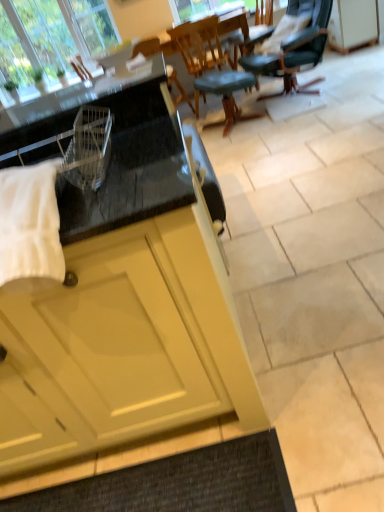
Image resolution: width=384 pixels, height=512 pixels. Identify the location of matte yellow cabinet at upper right, the second cabinetry ordered from the bottom. (353, 24).

Where is `clear glass window at upper left`? This screenshot has height=512, width=384. clear glass window at upper left is located at coordinates (51, 35).

The height and width of the screenshot is (512, 384). What do you see at coordinates (121, 302) in the screenshot?
I see `matte yellow cabinet at lower left, the 1th cabinetry ordered from the bottom` at bounding box center [121, 302].

This screenshot has width=384, height=512. Describe the element at coordinates (179, 483) in the screenshot. I see `dark gray textured mat at lower center` at that location.

This screenshot has height=512, width=384. In order to click on matte yellow cabinet at upper right, arranged as the second cabinetry when viewed from the left in this screenshot , I will do `click(353, 24)`.

Between teal leather stool at center and matte yellow cabinet at upper right, which is the 1th cabinetry in right-to-left order, which one has more height?

matte yellow cabinet at upper right, which is the 1th cabinetry in right-to-left order.

Is teal leather stool at center aimed at matte yellow cabinet at upper right, the second cabinetry ordered from the bottom?

No, teal leather stool at center is not facing towards matte yellow cabinet at upper right, the second cabinetry ordered from the bottom.

Is the depth of teal leather stool at center greater than that of matte yellow cabinet at upper right, the second cabinetry ordered from the bottom?

No, teal leather stool at center is closer to the camera.

Is teal leather stool at center bigger than matte yellow cabinet at upper right, the 2th cabinetry viewed from the front?

Indeed, teal leather stool at center has a larger size compared to matte yellow cabinet at upper right, the 2th cabinetry viewed from the front.

Who is more distant, green leather office chair at upper right, the second chair when ordered from left to right, or wooden chair at center, which appears as the second chair when viewed from the right?

Positioned behind is wooden chair at center, which appears as the second chair when viewed from the right.

Does green leather office chair at upper right, the second chair when ordered from left to right, have a lesser height compared to wooden chair at center, which appears as the first chair when viewed from the left?

No, green leather office chair at upper right, the second chair when ordered from left to right, is not shorter than wooden chair at center, which appears as the first chair when viewed from the left.

Could wooden chair at center, which appears as the first chair when viewed from the left, be considered to be inside green leather office chair at upper right, the second chair when ordered from left to right?

No, wooden chair at center, which appears as the first chair when viewed from the left, is located outside of green leather office chair at upper right, the second chair when ordered from left to right.

From a real-world perspective, between dark gray textured mat at lower center and green leather office chair at upper right, positioned as the first chair in right-to-left order, who is vertically higher?

From a 3D spatial view, green leather office chair at upper right, positioned as the first chair in right-to-left order, is above.

Is dark gray textured mat at lower center wider or thinner than green leather office chair at upper right, positioned as the first chair in right-to-left order?

Considering their sizes, dark gray textured mat at lower center looks slimmer than green leather office chair at upper right, positioned as the first chair in right-to-left order.

Is dark gray textured mat at lower center not inside green leather office chair at upper right, positioned as the first chair in right-to-left order?

Indeed, dark gray textured mat at lower center is completely outside green leather office chair at upper right, positioned as the first chair in right-to-left order.

From the image's perspective, is clear glass window at upper left over green leather office chair at upper right, positioned as the first chair in right-to-left order?

Indeed, from the image's perspective, clear glass window at upper left is shown above green leather office chair at upper right, positioned as the first chair in right-to-left order.

Is clear glass window at upper left smaller than green leather office chair at upper right, the second chair when ordered from left to right?

Correct, clear glass window at upper left occupies less space than green leather office chair at upper right, the second chair when ordered from left to right.

From a real-world perspective, is clear glass window at upper left over green leather office chair at upper right, the second chair when ordered from left to right?

Yes, from a real-world perspective, clear glass window at upper left is above green leather office chair at upper right, the second chair when ordered from left to right.

Is clear glass window at upper left bigger or smaller than matte yellow cabinet at lower left, marked as the second cabinetry in a right-to-left arrangement?

In the image, clear glass window at upper left appears to be smaller than matte yellow cabinet at lower left, marked as the second cabinetry in a right-to-left arrangement.

From the image's perspective, which is above, clear glass window at upper left or matte yellow cabinet at lower left, which ranks as the first cabinetry in front-to-back order?

clear glass window at upper left appears higher in the image.

Between point (13, 17) and point (163, 90), which one is positioned behind?

The point (13, 17) is farther.

Between clear glass window at upper left and matte yellow cabinet at lower left, the 1th cabinetry ordered from the bottom, which one is positioned behind?

clear glass window at upper left is behind.

From a real-world perspective, relative to dark gray textured mat at lower center, is green leather office chair at upper right, the second chair when ordered from left to right, vertically above or below?

green leather office chair at upper right, the second chair when ordered from left to right, is above dark gray textured mat at lower center.

Which is behind, point (306, 91) or point (96, 510)?

The point (306, 91) is farther.

Looking at this image, which is more to the left, green leather office chair at upper right, positioned as the first chair in right-to-left order, or dark gray textured mat at lower center?

Positioned to the left is dark gray textured mat at lower center.

Can you confirm if green leather office chair at upper right, positioned as the first chair in right-to-left order, is smaller than dark gray textured mat at lower center?

Actually, green leather office chair at upper right, positioned as the first chair in right-to-left order, might be larger than dark gray textured mat at lower center.

Which is more to the left, matte yellow cabinet at upper right, which is counted as the first cabinetry, starting from the back, or dark gray textured mat at lower center?

dark gray textured mat at lower center is more to the left.

Is dark gray textured mat at lower center inside matte yellow cabinet at upper right, which is the 1th cabinetry in right-to-left order?

No, dark gray textured mat at lower center is not inside matte yellow cabinet at upper right, which is the 1th cabinetry in right-to-left order.

Considering the sizes of objects matte yellow cabinet at upper right, the second cabinetry ordered from the bottom, and dark gray textured mat at lower center in the image provided, who is shorter, matte yellow cabinet at upper right, the second cabinetry ordered from the bottom, or dark gray textured mat at lower center?

With less height is dark gray textured mat at lower center.

Looking at this image, is matte yellow cabinet at upper right, which is counted as the first cabinetry, starting from the back, positioned behind dark gray textured mat at lower center?

Yes, the depth of matte yellow cabinet at upper right, which is counted as the first cabinetry, starting from the back, is greater than that of dark gray textured mat at lower center.

The width and height of the screenshot is (384, 512). In order to click on cabinetry behind the teal leather stool at center in this screenshot , I will do `click(353, 24)`.

Image resolution: width=384 pixels, height=512 pixels. I want to click on chair above the wooden chair at center, which appears as the first chair when viewed from the left (from a real-world perspective), so click(295, 50).

Based on their spatial positions, is dark gray textured mat at lower center or green leather office chair at upper right, the second chair when ordered from left to right, further from clear glass window at upper left?

green leather office chair at upper right, the second chair when ordered from left to right.

When comparing their distances from matte yellow cabinet at upper right, which is counted as the first cabinetry, starting from the back, does dark gray textured mat at lower center or teal leather stool at center seem closer?

teal leather stool at center.

Based on the photo, when comparing their distances from green leather office chair at upper right, the second chair when ordered from left to right, does wooden chair at center, which appears as the first chair when viewed from the left, or teal leather stool at center seem further?

wooden chair at center, which appears as the first chair when viewed from the left, lies further to green leather office chair at upper right, the second chair when ordered from left to right, than the other object.

From the image, which object appears to be nearer to wooden chair at center, which appears as the second chair when viewed from the right, teal leather stool at center or clear glass window at upper left?

teal leather stool at center is positioned closer to the anchor wooden chair at center, which appears as the second chair when viewed from the right.

From the picture: Looking at the image, which one is located closer to wooden chair at center, which appears as the first chair when viewed from the left, matte yellow cabinet at upper right, marked as the first cabinetry in a top-to-bottom arrangement, or teal leather stool at center?

Based on the image, teal leather stool at center appears to be nearer to wooden chair at center, which appears as the first chair when viewed from the left.

When comparing their distances from matte yellow cabinet at lower left, which is the 2th cabinetry in back-to-front order, does teal leather stool at center or green leather office chair at upper right, positioned as the first chair in right-to-left order, seem closer?

green leather office chair at upper right, positioned as the first chair in right-to-left order, is positioned closer to the anchor matte yellow cabinet at lower left, which is the 2th cabinetry in back-to-front order.

Estimate the real-world distances between objects in this image. Which object is closer to dark gray textured mat at lower center, teal leather stool at center or wooden chair at center, which appears as the first chair when viewed from the left?

wooden chair at center, which appears as the first chair when viewed from the left.

Based on their spatial positions, is teal leather stool at center or dark gray textured mat at lower center further from matte yellow cabinet at upper right, the second cabinetry ordered from the bottom?

The object further to matte yellow cabinet at upper right, the second cabinetry ordered from the bottom, is dark gray textured mat at lower center.

Image resolution: width=384 pixels, height=512 pixels. In order to click on stool between matte yellow cabinet at upper right, the second cabinetry ordered from the bottom, and dark gray textured mat at lower center vertically in this screenshot , I will do 225,93.

The width and height of the screenshot is (384, 512). Find the location of `stool that lies between wooden chair at center, which appears as the second chair when viewed from the right, and dark gray textured mat at lower center from top to bottom`. stool that lies between wooden chair at center, which appears as the second chair when viewed from the right, and dark gray textured mat at lower center from top to bottom is located at coordinates (225, 93).

You are a GUI agent. You are given a task and a screenshot of the screen. Output one action in this format:
    pyautogui.click(x=<x>, y=<y>)
    Task: Click on the stool positioned between matte yellow cabinet at lower left, marked as the second cabinetry in a top-to-bottom arrangement, and matte yellow cabinet at upper right, arranged as the second cabinetry when viewed from the left, from near to far
    This screenshot has height=512, width=384.
    Given the screenshot: What is the action you would take?
    pyautogui.click(x=225, y=93)

Where is `doormat located between matte yellow cabinet at lower left, which is the 2th cabinetry in back-to-front order, and clear glass window at upper left in the depth direction`? doormat located between matte yellow cabinet at lower left, which is the 2th cabinetry in back-to-front order, and clear glass window at upper left in the depth direction is located at coordinates (179, 483).